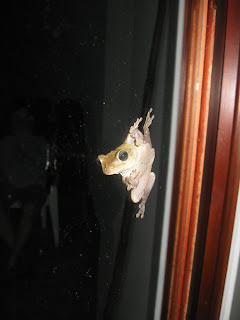
The width and height of the screenshot is (240, 320). Find the location of `window`. window is located at coordinates (80, 171), (75, 248).